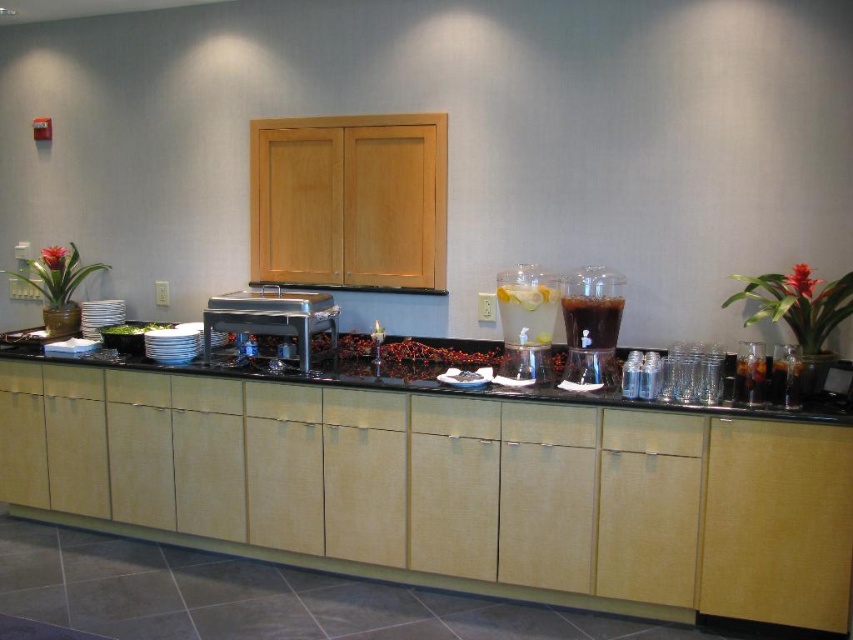
Which is above, black granite counter at center or clear plastic pitcher at center?

clear plastic pitcher at center

Does black granite counter at center have a larger size compared to clear plastic pitcher at center?

Correct, black granite counter at center is larger in size than clear plastic pitcher at center.

Find the location of a particular element. black granite counter at center is located at coordinates (457, 368).

The width and height of the screenshot is (853, 640). What are the coordinates of `black granite counter at center` in the screenshot? It's located at (457, 368).

Who is lower down, black laminate counter at center or white porcelain plates at center?

Positioned lower is black laminate counter at center.

Does black laminate counter at center have a greater width compared to white porcelain plates at center?

Yes, black laminate counter at center is wider than white porcelain plates at center.

Measure the distance between black laminate counter at center and camera.

The distance of black laminate counter at center from camera is 8.44 feet.

Image resolution: width=853 pixels, height=640 pixels. What are the coordinates of `black laminate counter at center` in the screenshot? It's located at (444, 484).

Looking at this image, which is more to the right, wooden drawer at center or white porcelain plates at center?

Positioned to the right is wooden drawer at center.

Between wooden drawer at center and white porcelain plates at center, which one has less height?

With less height is white porcelain plates at center.

What are the coordinates of `wooden drawer at center` in the screenshot? It's located at (653, 433).

Find the location of a particular element. This screenshot has width=853, height=640. wooden drawer at center is located at coordinates (653, 433).